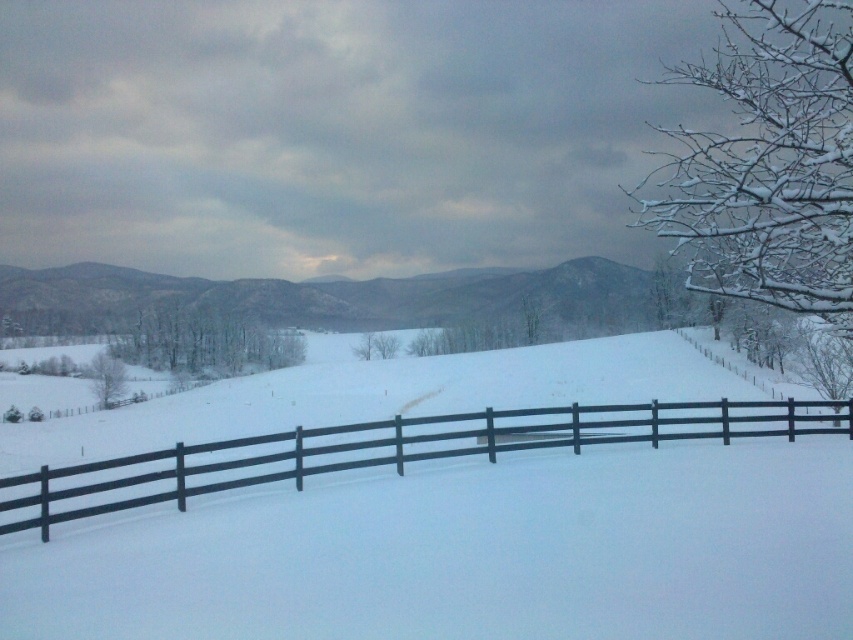
You are an animal trying to cross the field. You see the white matte snow at center and the black wooden fence at center. Which path is wider for you to move through?

The white matte snow at center is wider than the black wooden fence at center, so the animal can move more easily through the white matte snow at center.

You are an observer standing in the winter landscape. You notice the white matte snow at center and the black wooden fence at center. Which object is taller?

The white matte snow at center is taller than the black wooden fence at center.

Looking at this image, you are standing in the winter landscape and want to walk from the point closer to you to the point further away. Which path would you take between the two points, point (x=194, y=580) and point (x=236, y=456)?

You should walk from point (x=194, y=580) to point (x=236, y=456) because point (x=194, y=580) is closer to the camera, so it is the starting point, and point (x=236, y=456) is further away.